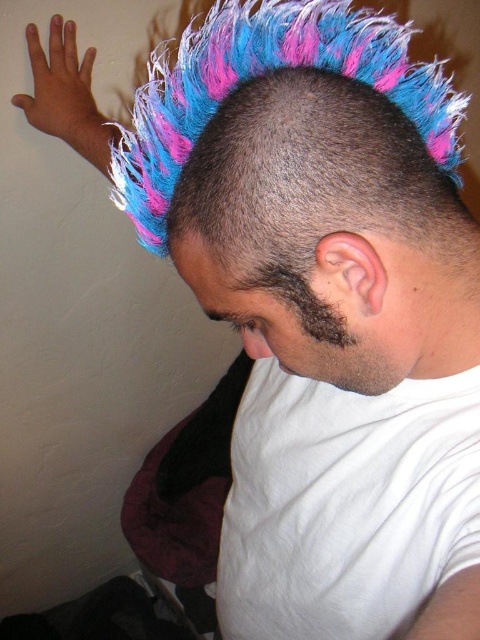
Does point (252, 106) lie in front of point (282, 285)?

Yes, it is.

How distant is shiny multicolored mohawk at center from dark brown fuzzy beard at lower right?

1.58 inches

Who is more distant from viewer, (475, 355) or (359, 266)?

Positioned behind is point (475, 355).

Locate an element on the screen. This screenshot has width=480, height=640. shiny multicolored mohawk at center is located at coordinates (327, 234).